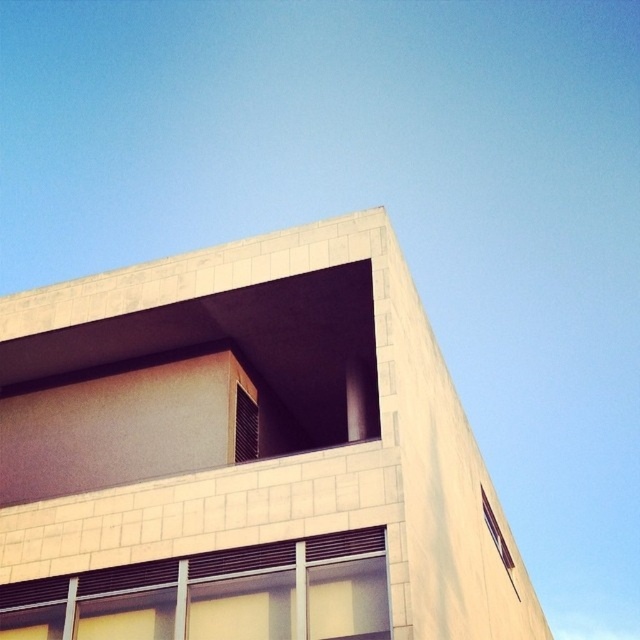
Which is more to the right, white textured window at lower center or transparent glass window at upper right?

Positioned to the right is transparent glass window at upper right.

Who is higher up, white textured window at lower center or transparent glass window at upper right?

white textured window at lower center is higher up.

This screenshot has width=640, height=640. Describe the element at coordinates (216, 595) in the screenshot. I see `white textured window at lower center` at that location.

Where is `white textured window at lower center`? The image size is (640, 640). white textured window at lower center is located at coordinates (216, 595).